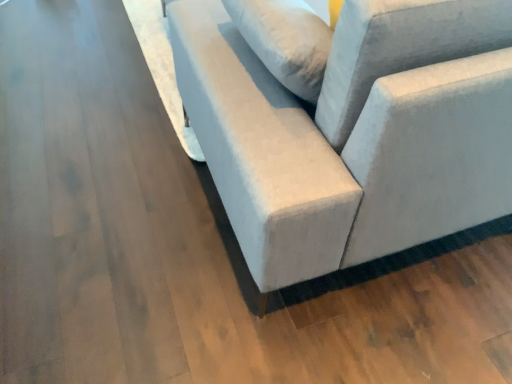
Measure the distance between light gray fabric couch at center and camera.

A distance of 26.98 inches exists between light gray fabric couch at center and camera.

Describe the element at coordinates (343, 152) in the screenshot. This screenshot has height=384, width=512. I see `light gray fabric couch at center` at that location.

The width and height of the screenshot is (512, 384). What are the coordinates of `light gray fabric couch at center` in the screenshot? It's located at (343, 152).

In order to click on light gray fabric couch at center in this screenshot , I will do `click(343, 152)`.